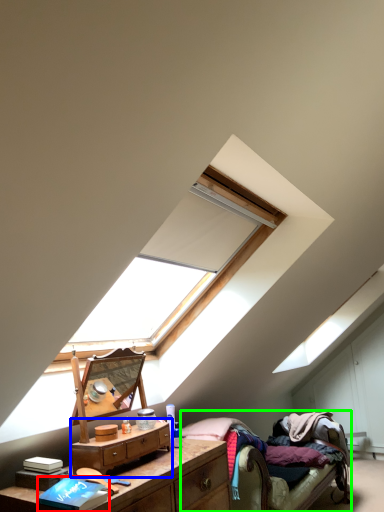
Question: Which object is the farthest from book (highlighted by a red box)? Choose among these: nightstand (highlighted by a blue box) or bed (highlighted by a green box).

Choices:
 (A) nightstand
 (B) bed

Answer: (B)